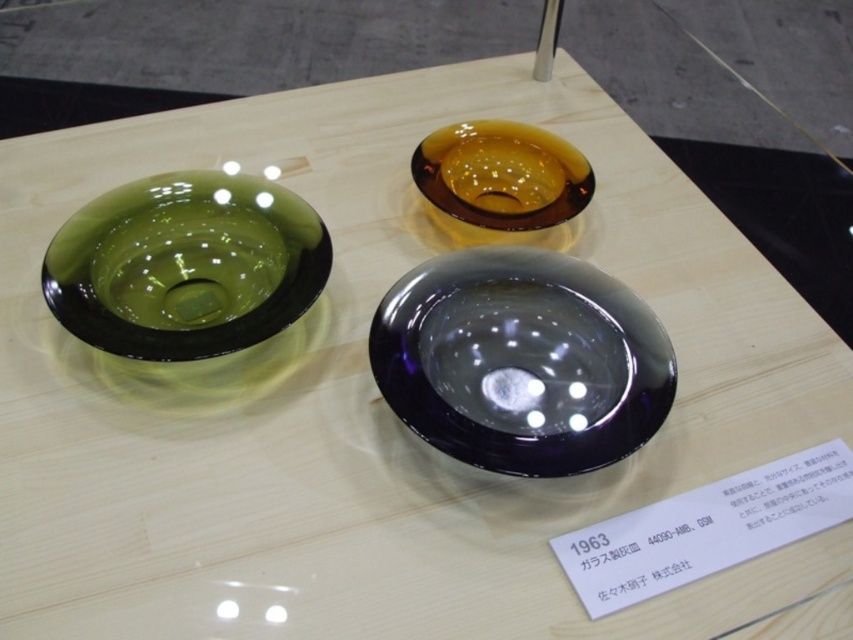
Question: Can you confirm if green glass bowl at left is positioned to the right of amber glass bowl at upper center?

Choices:
 (A) yes
 (B) no

Answer: (B)

Question: From the image, what is the correct spatial relationship of amber glass bowl at center in relation to amber glass bowl at upper center?

Choices:
 (A) below
 (B) above

Answer: (A)

Question: Is the position of amber glass bowl at center more distant than that of green glass bowl at left?

Choices:
 (A) yes
 (B) no

Answer: (B)

Question: Considering the real-world distances, which object is closest to the green glass bowl at left?

Choices:
 (A) amber glass bowl at upper center
 (B) amber glass bowl at center

Answer: (B)

Question: Which point is closer to the camera taking this photo?

Choices:
 (A) (x=616, y=356)
 (B) (x=165, y=346)
 (C) (x=490, y=150)

Answer: (B)

Question: Which of the following is the farthest from the observer?

Choices:
 (A) (589, 424)
 (B) (422, 164)

Answer: (B)